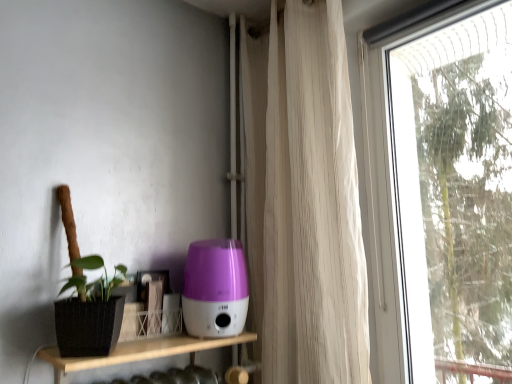
Locate an element on the screen. This screenshot has height=384, width=512. free region on the left part of purple plastic humidifier at center is located at coordinates (153, 336).